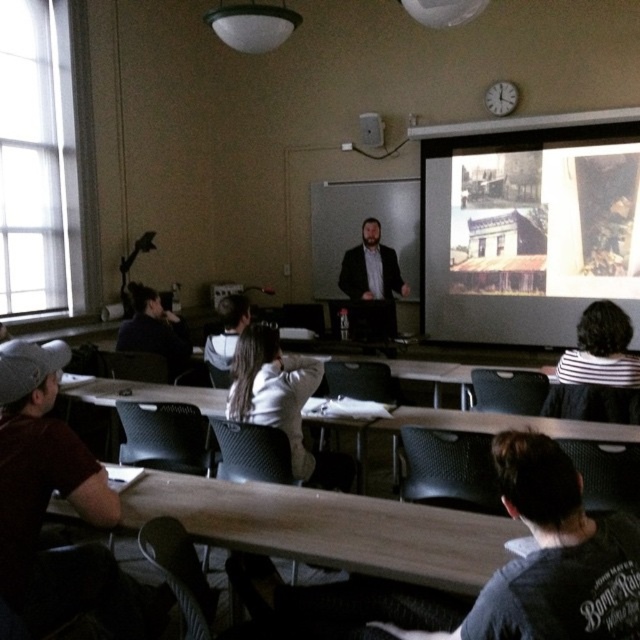
Question: Does matte black screen at upper right come in front of dark red t-shirt at left?

Choices:
 (A) yes
 (B) no

Answer: (B)

Question: Which object is the closest to the dark red t-shirt at left?

Choices:
 (A) dark brown hair at left
 (B) matte black screen at upper right
 (C) dark brown suit at center

Answer: (A)

Question: Which object is positioned farthest from the dark red t-shirt at left?

Choices:
 (A) matte black screen at upper right
 (B) dark brown suit at center
 (C) dark brown hair at left

Answer: (A)

Question: Can you confirm if dark brown suit at center is wider than dark brown hair at left?

Choices:
 (A) no
 (B) yes

Answer: (B)

Question: Can you confirm if dark red t-shirt at left is wider than dark brown suit at center?

Choices:
 (A) yes
 (B) no

Answer: (B)

Question: Among these points, which one is nearest to the camera?

Choices:
 (A) coord(627,278)
 (B) coord(35,438)

Answer: (B)